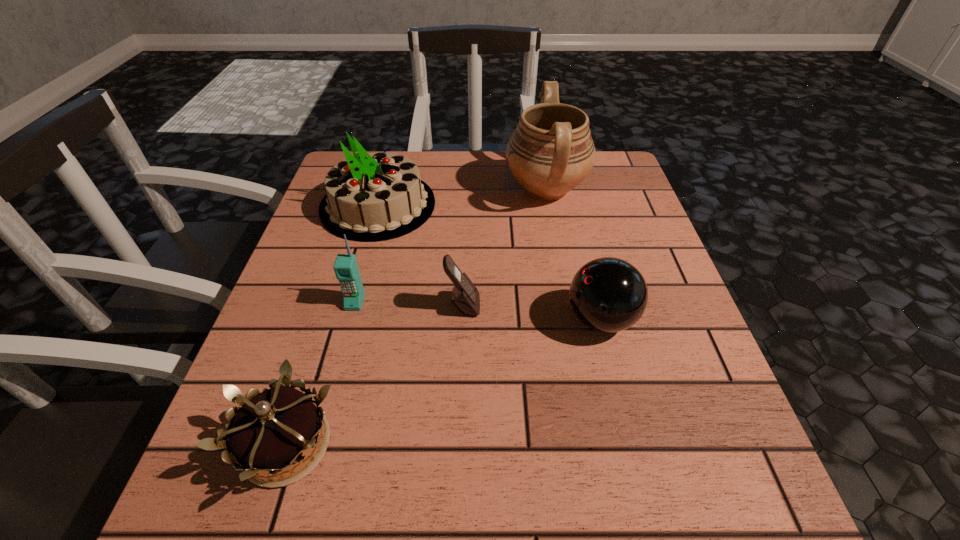
Locate an element on the screen. This screenshot has width=960, height=540. blank region between the fourth object from left to right and the bowling ball is located at coordinates (532, 312).

Identify the location of vacant region between the urn and the crown. (417, 317).

Locate an element on the screen. blank region between the right cellular telephone and the nearest object is located at coordinates [x=375, y=375].

Find the location of a particular element. object that stands as the second closest to the second tallest object is located at coordinates (465, 296).

Identify which object is the third nearest to the urn. Please provide its 2D coordinates. Your answer should be formatted as a tuple, i.e. [(x, y)], where the tuple contains the x and y coordinates of a point satisfying the conditions above.

[(465, 296)]

Where is `vacant space that satisfies the following two spatial constraints: 1. on the front-facing side of the shorter cellular telephone; 2. on the front side of the nearest object`? vacant space that satisfies the following two spatial constraints: 1. on the front-facing side of the shorter cellular telephone; 2. on the front side of the nearest object is located at coordinates (458, 445).